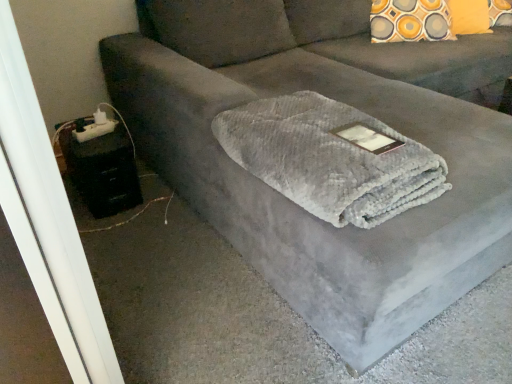
Question: From a real-world perspective, is black plastic table at lower left under gray plush blanket at center?

Choices:
 (A) yes
 (B) no

Answer: (A)

Question: Is black plastic table at lower left located outside gray plush blanket at center?

Choices:
 (A) no
 (B) yes

Answer: (B)

Question: Does black plastic table at lower left turn towards gray plush blanket at center?

Choices:
 (A) yes
 (B) no

Answer: (B)

Question: Is black plastic table at lower left to the right of gray plush blanket at center from the viewer's perspective?

Choices:
 (A) no
 (B) yes

Answer: (A)

Question: Is the depth of black plastic table at lower left greater than that of gray plush blanket at center?

Choices:
 (A) no
 (B) yes

Answer: (B)

Question: Can you confirm if black plastic table at lower left is thinner than gray plush blanket at center?

Choices:
 (A) yes
 (B) no

Answer: (A)

Question: Is gray plush blanket at center far away from black plastic table at lower left?

Choices:
 (A) yes
 (B) no

Answer: (B)

Question: Is gray plush blanket at center outside black plastic table at lower left?

Choices:
 (A) no
 (B) yes

Answer: (B)

Question: Is gray plush blanket at center thinner than black plastic table at lower left?

Choices:
 (A) no
 (B) yes

Answer: (A)

Question: From a real-world perspective, is gray plush blanket at center below black plastic table at lower left?

Choices:
 (A) yes
 (B) no

Answer: (B)

Question: From the image's perspective, is gray plush blanket at center on top of black plastic table at lower left?

Choices:
 (A) no
 (B) yes

Answer: (B)

Question: Is black plastic table at lower left at the back of gray plush blanket at center?

Choices:
 (A) yes
 (B) no

Answer: (B)

Question: Is black plastic table at lower left bigger or smaller than gray plush blanket at center?

Choices:
 (A) big
 (B) small

Answer: (B)